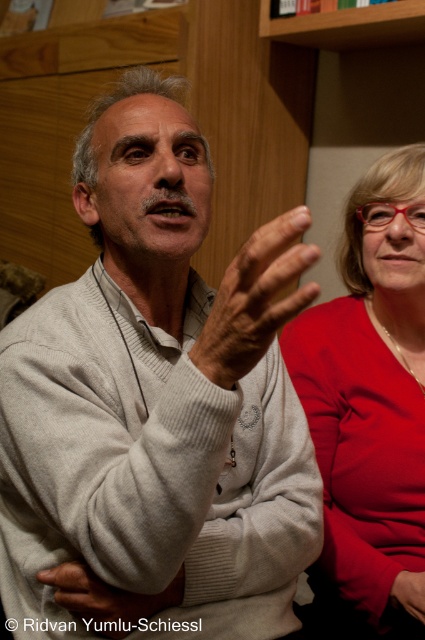
Question: Which object is positioned farthest from the gray woolen sweater at center?

Choices:
 (A) matte skin hand at center
 (B) light gray knitted sweater at center
 (C) smooth beige hand at center
 (D) matte red blouse at right

Answer: (A)

Question: From the image, what is the correct spatial relationship of light gray knitted sweater at center in relation to matte skin hand at center?

Choices:
 (A) above
 (B) below

Answer: (A)

Question: Does matte red blouse at right have a greater width compared to matte skin hand at center?

Choices:
 (A) no
 (B) yes

Answer: (B)

Question: Which object is the farthest from the matte red blouse at right?

Choices:
 (A) smooth beige hand at center
 (B) gray woolen sweater at center
 (C) matte skin hand at center

Answer: (B)

Question: Observing the image, what is the correct spatial positioning of gray woolen sweater at center in reference to smooth beige hand at center?

Choices:
 (A) left
 (B) right

Answer: (B)

Question: Based on their relative distances, which object is nearer to the gray woolen sweater at center?

Choices:
 (A) matte red blouse at right
 (B) matte skin hand at center
 (C) light gray knitted sweater at center
 (D) smooth beige hand at center

Answer: (C)